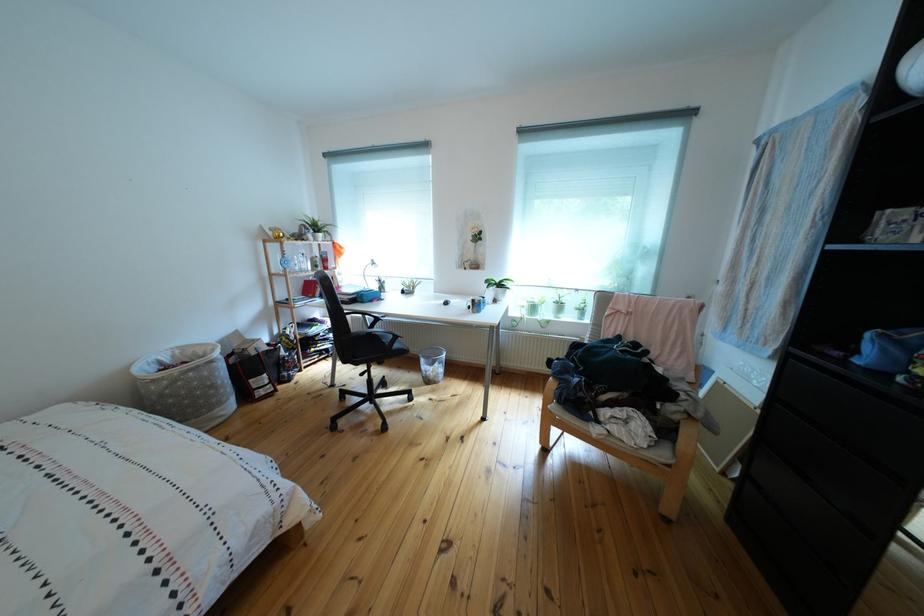
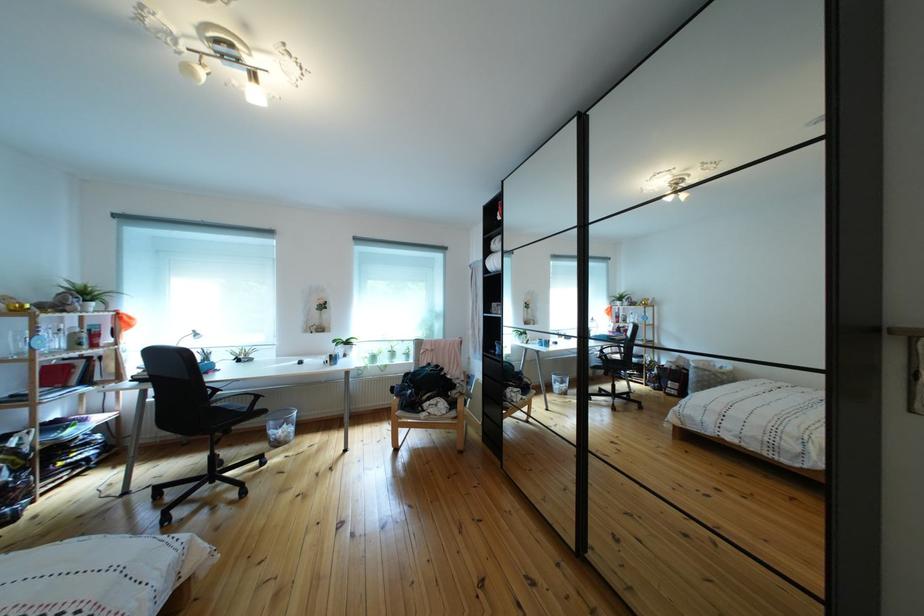
In the second image, find the point that corresponds to the point at 388,325 in the first image.

(227, 395)